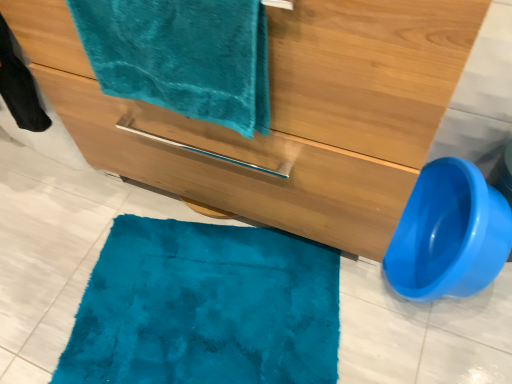
Question: Is matte wood bathroom cabinet at center taller than teal plush towel at upper left?

Choices:
 (A) no
 (B) yes

Answer: (B)

Question: Is matte wood bathroom cabinet at center shorter than teal plush towel at upper left?

Choices:
 (A) yes
 (B) no

Answer: (B)

Question: Is matte wood bathroom cabinet at center next to teal plush towel at upper left?

Choices:
 (A) no
 (B) yes

Answer: (A)

Question: Considering the relative positions of matte wood bathroom cabinet at center and teal plush towel at upper left in the image provided, is matte wood bathroom cabinet at center behind teal plush towel at upper left?

Choices:
 (A) yes
 (B) no

Answer: (B)

Question: From a real-world perspective, is matte wood bathroom cabinet at center below teal plush towel at upper left?

Choices:
 (A) no
 (B) yes

Answer: (B)

Question: Is matte wood bathroom cabinet at center completely or partially outside of teal plush towel at upper left?

Choices:
 (A) yes
 (B) no

Answer: (A)

Question: From the image's perspective, does teal plush towel at upper left appear lower than blue plastic toilet bowl at lower right?

Choices:
 (A) yes
 (B) no

Answer: (B)

Question: Does teal plush towel at upper left have a smaller size compared to blue plastic toilet bowl at lower right?

Choices:
 (A) yes
 (B) no

Answer: (A)

Question: Is teal plush towel at upper left to the right of blue plastic toilet bowl at lower right from the viewer's perspective?

Choices:
 (A) yes
 (B) no

Answer: (B)

Question: Is the surface of teal plush towel at upper left in direct contact with blue plastic toilet bowl at lower right?

Choices:
 (A) yes
 (B) no

Answer: (B)

Question: From the image's perspective, is teal plush towel at upper left over blue plastic toilet bowl at lower right?

Choices:
 (A) no
 (B) yes

Answer: (B)

Question: Is blue plastic toilet bowl at lower right at the back of teal plush towel at upper left?

Choices:
 (A) yes
 (B) no

Answer: (B)

Question: Considering the relative positions of blue plastic toilet bowl at lower right and teal plush towel at upper left in the image provided, is blue plastic toilet bowl at lower right to the left of teal plush towel at upper left from the viewer's perspective?

Choices:
 (A) no
 (B) yes

Answer: (A)